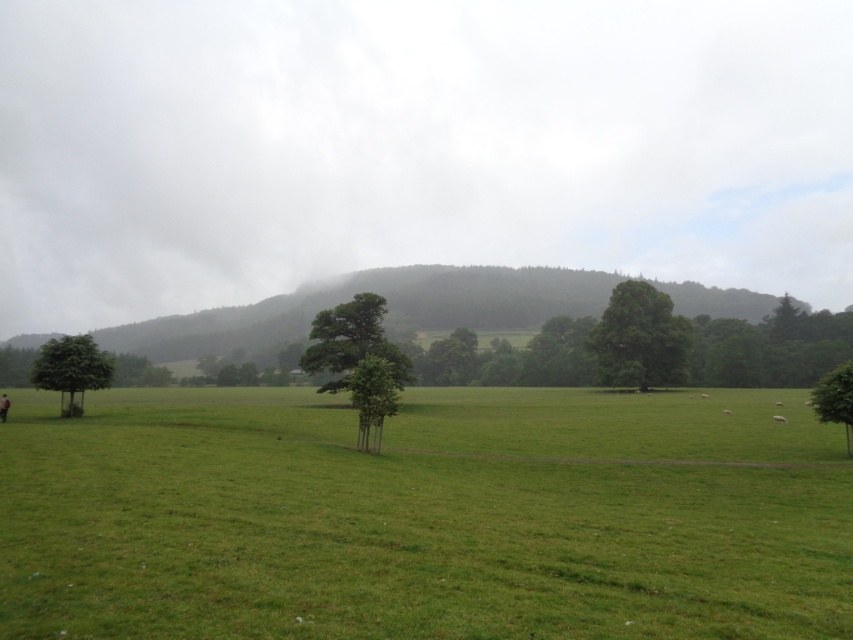
You are a hiker standing in the green grass pasture at center and want to reach the green leafy tree at right. Which direction should you move to get closer to the tree?

The green grass pasture at center is in front of the green leafy tree at right, so you should move backward to get closer to the tree.